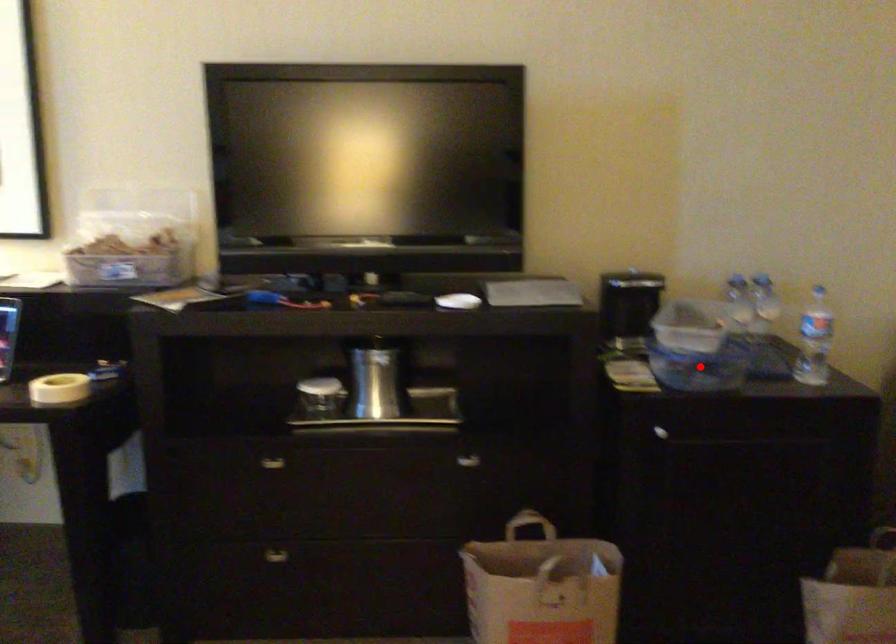
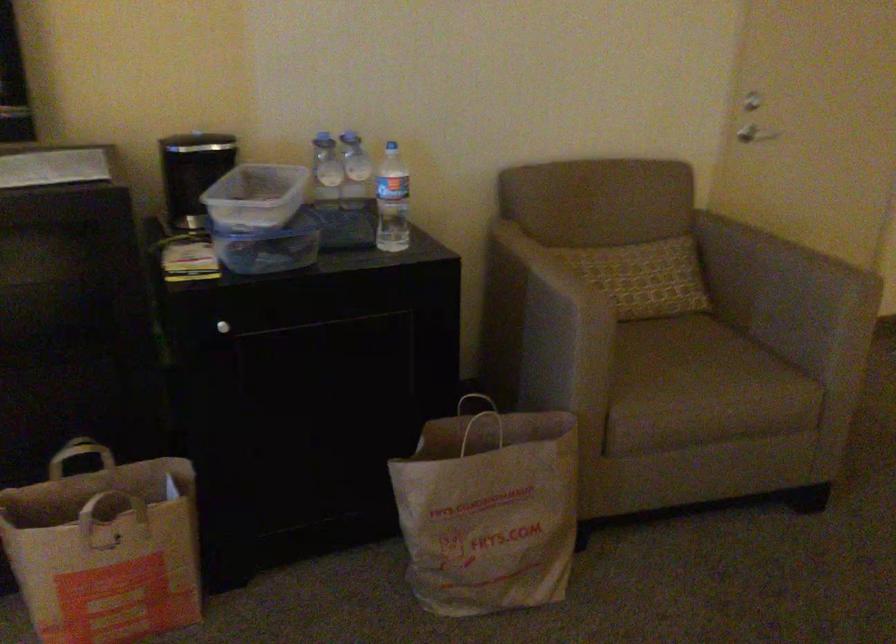
Question: I am providing you with two images of the same scene from different viewpoints. Given a red point in image1, look at the same physical point in image2. Is it:

Choices:
 (A) Closer to the viewpoint
 (B) Farther from the viewpoint

Answer: (A)